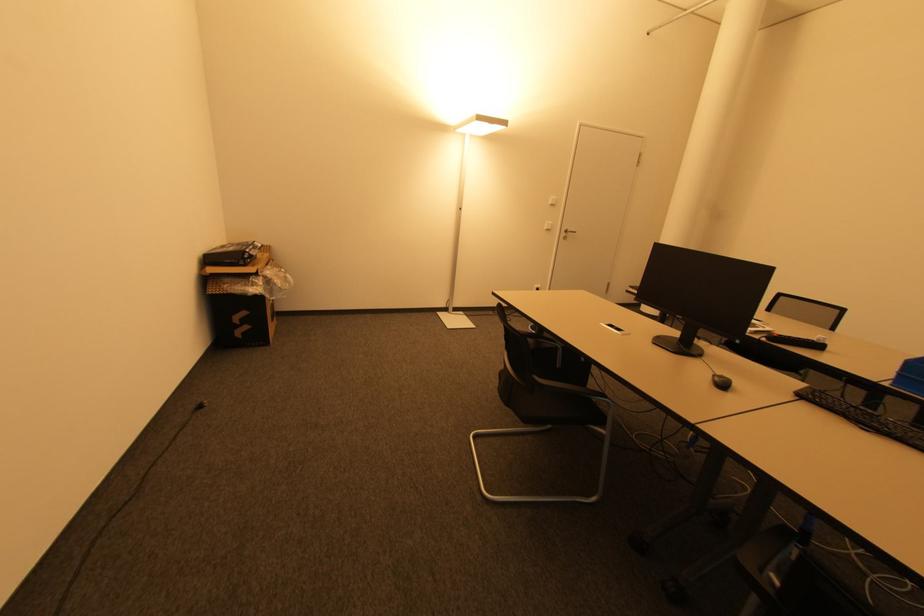
What do you see at coordinates (575, 373) in the screenshot? I see `the chair sitting surface` at bounding box center [575, 373].